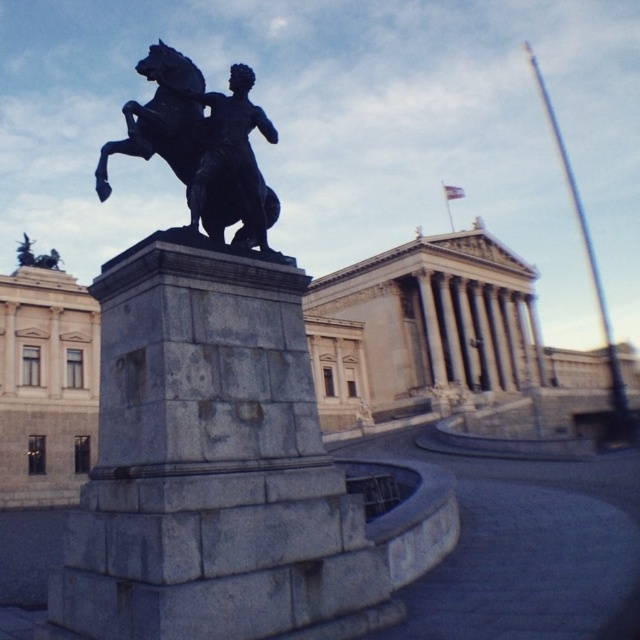
Which is more to the left, black polished stone statue at center or polished bronze statue at center?

From the viewer's perspective, black polished stone statue at center appears more on the left side.

Find the location of a particular element. black polished stone statue at center is located at coordinates (209, 413).

Find the location of a particular element. The width and height of the screenshot is (640, 640). black polished stone statue at center is located at coordinates (209, 413).

Is polished bronze statue at center closer to camera compared to polished bronze horse at center?

Yes, polished bronze statue at center is closer to the viewer.

Based on the photo, who is lower down, polished bronze statue at center or polished bronze horse at center?

polished bronze statue at center is below.

Is point (260, 193) more distant than point (150, 60)?

That is True.

Identify the location of polished bronze statue at center. (232, 156).

Can you confirm if black polished stone statue at center is shorter than polished bronze horse at center?

No, black polished stone statue at center is not shorter than polished bronze horse at center.

Is black polished stone statue at center thinner than polished bronze horse at center?

Incorrect, black polished stone statue at center's width is not less than polished bronze horse at center's.

Where is `black polished stone statue at center`? black polished stone statue at center is located at coordinates (209, 413).